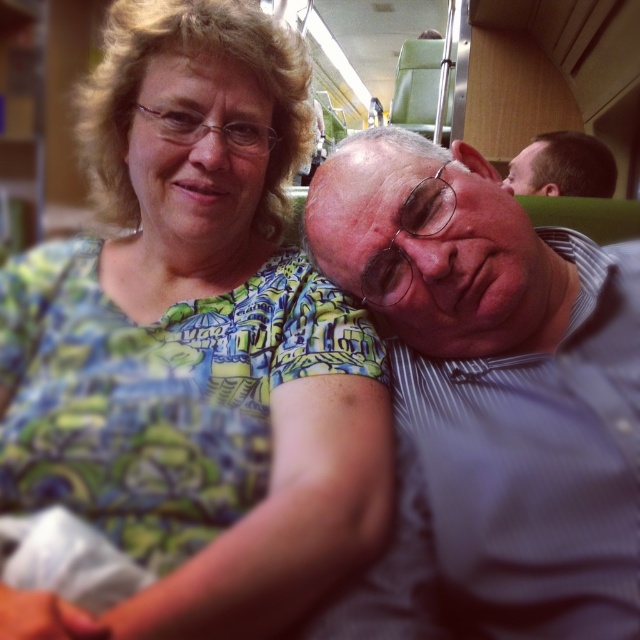
Between green printed fabric at upper left and matte gray shirt at center, which one appears on the right side from the viewer's perspective?

From the viewer's perspective, matte gray shirt at center appears more on the right side.

Is green printed fabric at upper left below matte gray shirt at center?

No, green printed fabric at upper left is not below matte gray shirt at center.

Who is more distant from viewer, (173, 134) or (630, 358)?

The point (173, 134) is behind.

At what (x,y) coordinates should I click in order to perform the action: click on green printed fabric at upper left. Please return your answer as a coordinate pair (x, y). The width and height of the screenshot is (640, 640). Looking at the image, I should click on (193, 342).

Does point (477, 193) lie in front of point (531, 182)?

Yes.

Is point (614, 342) farther from camera compared to point (540, 180)?

No.

Where is `matte gray shirt at center`? matte gray shirt at center is located at coordinates (488, 397).

Between point (256, 228) and point (589, 164), which one is positioned behind?

The point (589, 164) is more distant.

Which is more to the right, green printed fabric at upper left or brown hair at upper right?

From the viewer's perspective, brown hair at upper right appears more on the right side.

Does point (337, 320) come farther from viewer compared to point (545, 177)?

No, (337, 320) is closer to viewer.

Find the location of a particular element. This screenshot has width=640, height=640. green printed fabric at upper left is located at coordinates (193, 342).